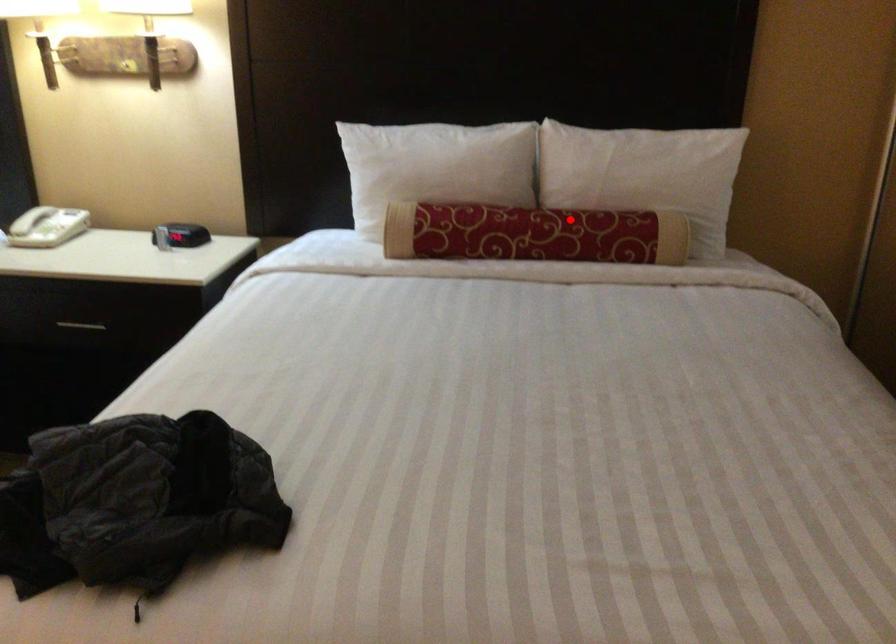
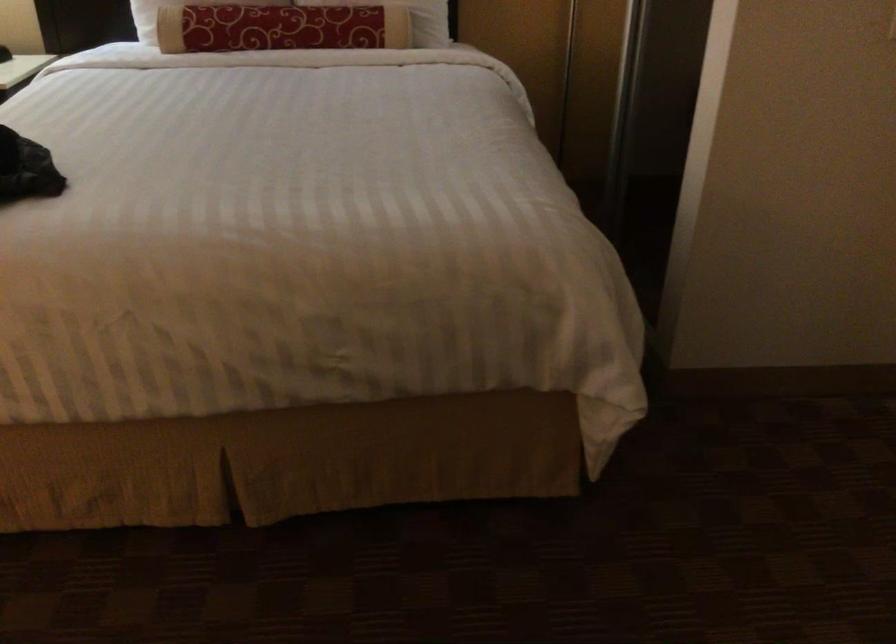
Locate, in the second image, the point that corresponds to the highlighted location in the first image.

(311, 15)